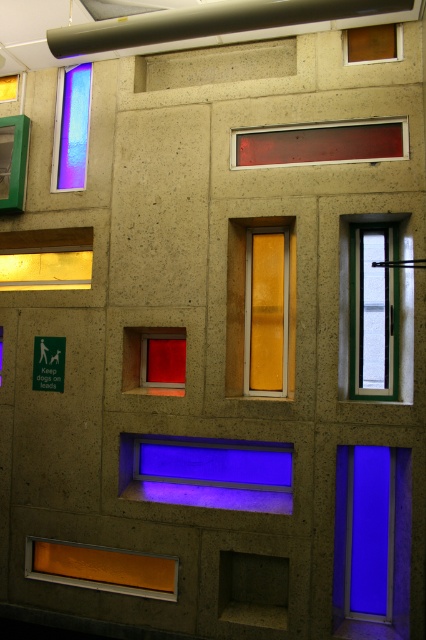
Question: Is clear glass door at right smaller than matte brown window at upper right?

Choices:
 (A) no
 (B) yes

Answer: (A)

Question: Is matte red sign at upper center to the left of matte red glass window at center from the viewer's perspective?

Choices:
 (A) no
 (B) yes

Answer: (A)

Question: Which of the following is the farthest from the observer?

Choices:
 (A) matte green glass window at left
 (B) matte gold window at lower left
 (C) blue glass window at right

Answer: (A)

Question: Which point appears closest to the camera in this image?

Choices:
 (A) (154, 476)
 (B) (132, 333)
 (C) (271, 140)
 (D) (396, 340)

Answer: (D)

Question: Considering the real-world distances, which object is closest to the transparent glass at upper left?

Choices:
 (A) blue glass window at center
 (B) matte green glass window at left
 (C) matte brown window at upper right
 (D) matte red glass window at center

Answer: (B)

Question: From the image, what is the correct spatial relationship of matte gold window at lower left in relation to matte red glass window at center?

Choices:
 (A) above
 (B) below

Answer: (A)